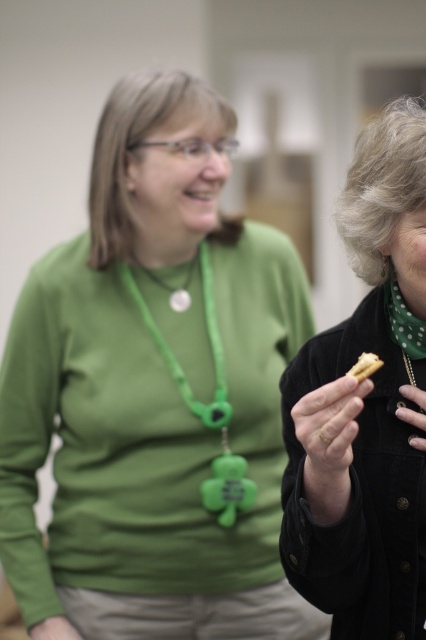
Question: Is green rubber necklace at center closer to the viewer compared to metallic gold ring at upper right?

Choices:
 (A) no
 (B) yes

Answer: (A)

Question: Is velvet black jacket at right smaller than brown matte cookie at center?

Choices:
 (A) no
 (B) yes

Answer: (A)

Question: Does velvet black jacket at right have a larger size compared to yellow matte cookie at center right?

Choices:
 (A) no
 (B) yes

Answer: (B)

Question: Estimate the real-world distances between objects in this image. Which object is closer to the green matte necklace at center?

Choices:
 (A) yellow matte cookie at center right
 (B) green rubber necklace at center

Answer: (B)

Question: Which object is positioned closest to the green rubber necklace at center?

Choices:
 (A) metallic gold ring at upper right
 (B) yellow matte cookie at center right
 (C) green matte necklace at center
 (D) brown matte cookie at center

Answer: (C)

Question: Which point is closer to the camera taking this photo?

Choices:
 (A) pos(221,461)
 (B) pos(302,417)
 (C) pos(408,406)

Answer: (B)